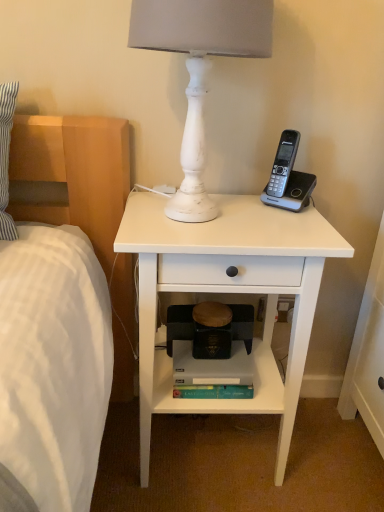
Where is `vacant area located to the right-hand side of white distressed wood lamp at upper center`? The width and height of the screenshot is (384, 512). vacant area located to the right-hand side of white distressed wood lamp at upper center is located at coordinates (288, 224).